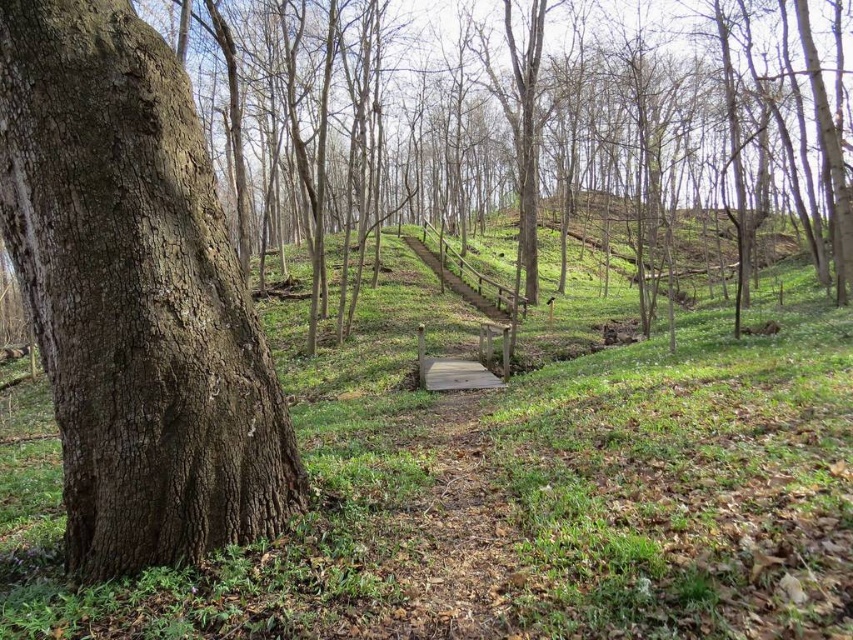
Question: Which object is positioned closest to the green grassy at center?

Choices:
 (A) brown rough bark tree at left
 (B) rough bark tree at left

Answer: (A)

Question: Where is rough bark tree at left located in relation to brown rough bark tree at left in the image?

Choices:
 (A) below
 (B) above

Answer: (B)

Question: In this image, where is green grassy at center located relative to brown rough bark tree at left?

Choices:
 (A) above
 (B) below

Answer: (B)

Question: Estimate the real-world distances between objects in this image. Which object is farther from the green grassy at center?

Choices:
 (A) brown rough bark tree at left
 (B) rough bark tree at left

Answer: (B)

Question: Is green grassy at center above brown rough bark tree at left?

Choices:
 (A) yes
 (B) no

Answer: (B)

Question: Which point is farther to the camera?

Choices:
 (A) rough bark tree at left
 (B) green grassy at center
 (C) brown rough bark tree at left

Answer: (A)